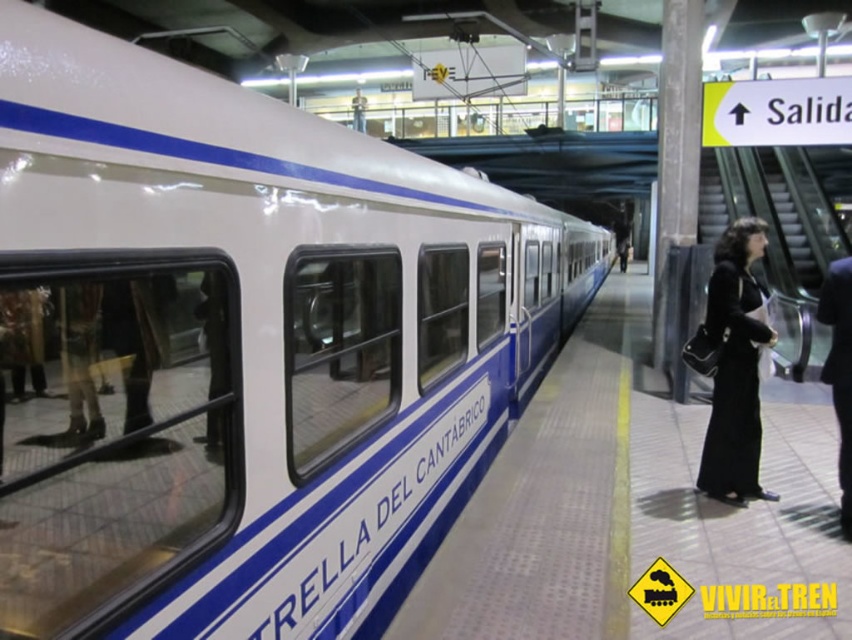
Based on the photo, who is shorter, white glossy train at left or black matte coat at right?

black matte coat at right is shorter.

Find the location of `white glossy train at left`. white glossy train at left is located at coordinates (243, 348).

Who is more forward, [272,116] or [833,372]?

Point [272,116] is more forward.

What do you see at coordinates (243, 348) in the screenshot?
I see `white glossy train at left` at bounding box center [243, 348].

Which is behind, point (332, 147) or point (839, 506)?

Positioned behind is point (839, 506).

Locate an element on the screen. white glossy train at left is located at coordinates (243, 348).

How distant is black matte coat at right from black fabric coat at right?

black matte coat at right and black fabric coat at right are 29.62 inches apart from each other.

Is black matte coat at right above black fabric coat at right?

Yes, black matte coat at right is above black fabric coat at right.

At what (x,y) coordinates should I click in order to perform the action: click on black matte coat at right. Please return your answer as a coordinate pair (x, y). This screenshot has height=640, width=852. Looking at the image, I should click on (734, 365).